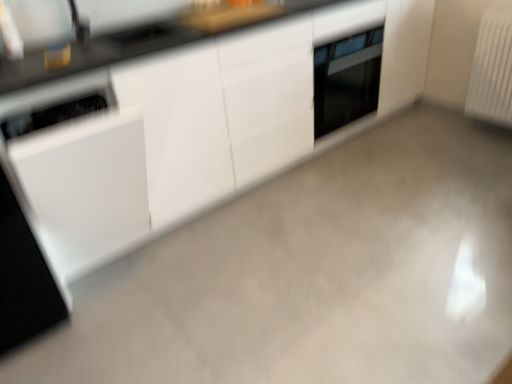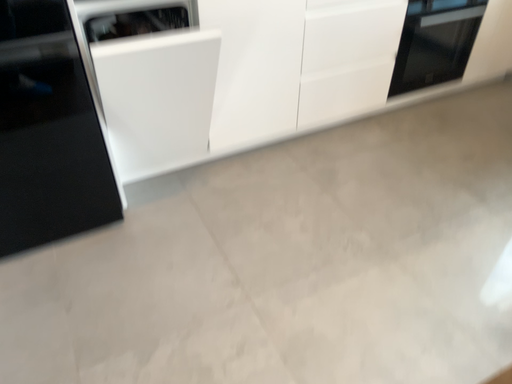
Question: How did the camera likely rotate when shooting the video?

Choices:
 (A) rotated downward
 (B) rotated upward

Answer: (A)